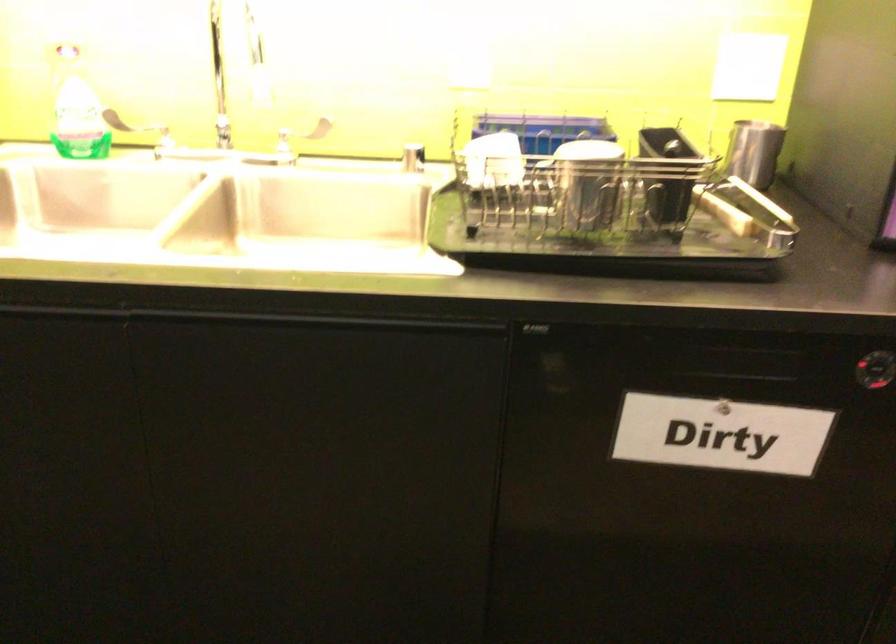
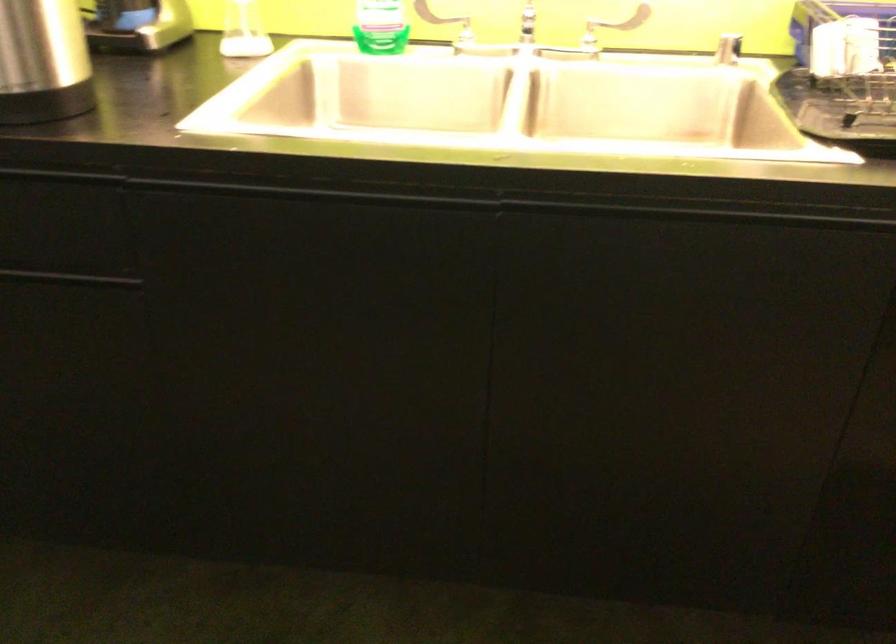
Question: Based on the continuous images, in which direction is the camera rotating? Reply with the corresponding letter.

Choices:
 (A) Left
 (B) Right
 (C) Up
 (D) Down

Answer: (A)